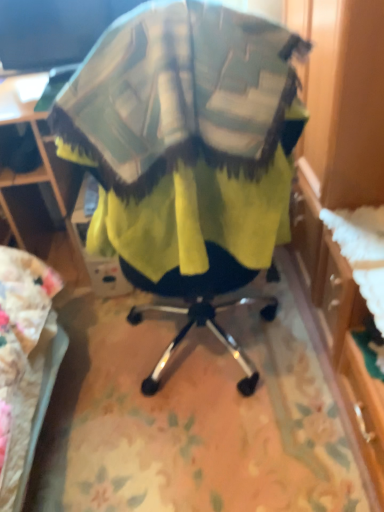
What is the approximate height of soft fabric bean bag at center?

It is 30.15 inches.

This screenshot has width=384, height=512. What do you see at coordinates (186, 143) in the screenshot? I see `soft fabric bean bag at center` at bounding box center [186, 143].

Locate an element on the screen. The width and height of the screenshot is (384, 512). soft fabric bean bag at center is located at coordinates (186, 143).

Measure the distance between soft fabric bean bag at center and camera.

A distance of 28.10 inches exists between soft fabric bean bag at center and camera.

Find the location of a particular element. soft fabric bean bag at center is located at coordinates (186, 143).